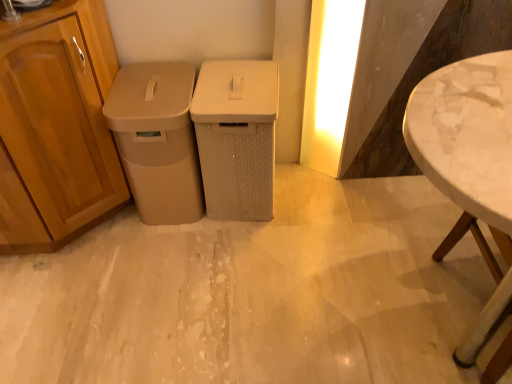
Find the location of a particular element. This screenshot has width=512, height=384. vacant area that lies between white marble table at right and beige textured waste bin at center, which appears as the second waste container when viewed from the left is located at coordinates (337, 247).